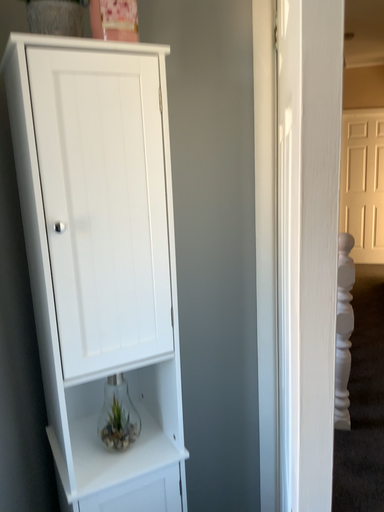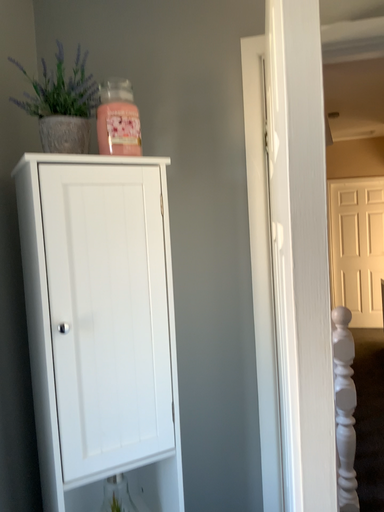
Question: Which way did the camera rotate in the video?

Choices:
 (A) rotated upward
 (B) rotated downward

Answer: (A)